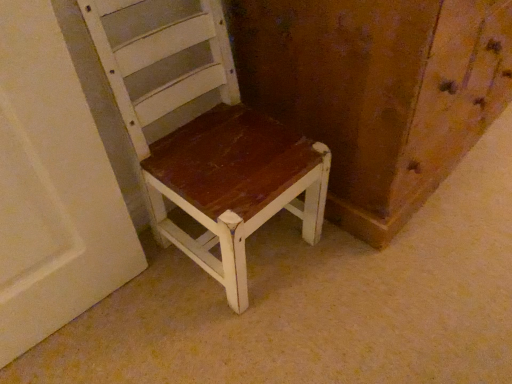
The height and width of the screenshot is (384, 512). I want to click on white wood chair at center, so click(x=211, y=147).

What do you see at coordinates (211, 147) in the screenshot? I see `white wood chair at center` at bounding box center [211, 147].

The image size is (512, 384). What are the coordinates of `white wood chair at center` in the screenshot? It's located at (211, 147).